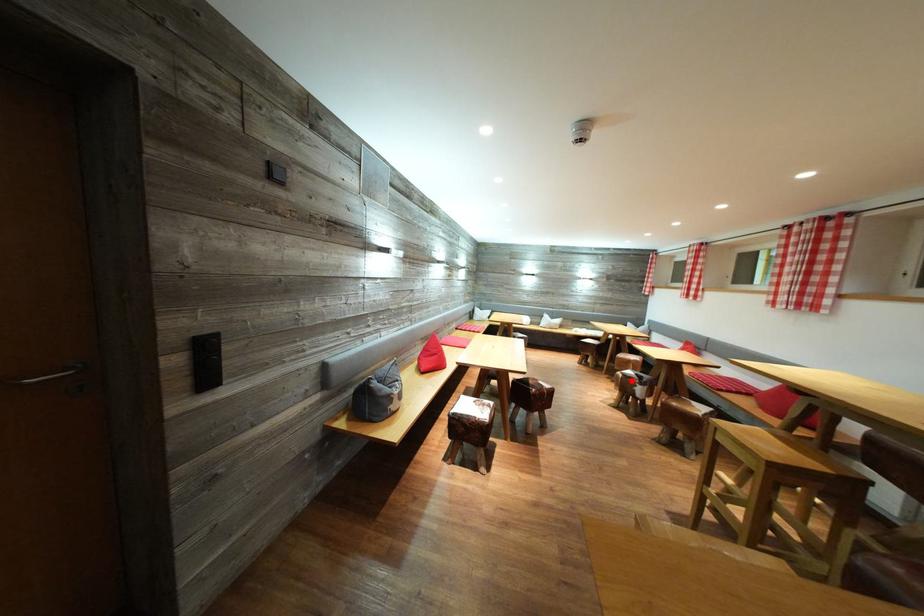
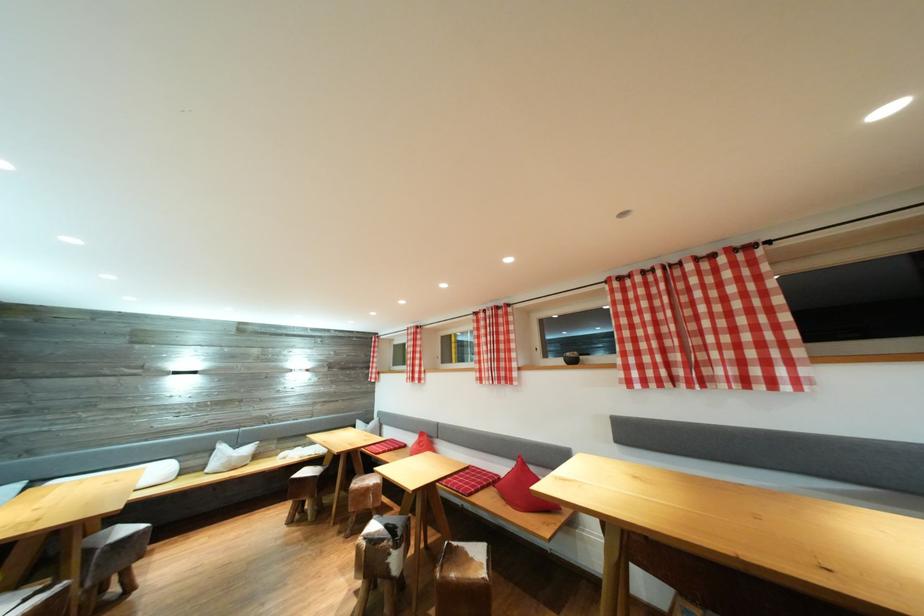
Question: A red point is marked in image1. In image2, is the corresponding 3D point closer to the camera or farther? Reply with the corresponding letter.

Choices:
 (A) The corresponding 3D point is closer.
 (B) The corresponding 3D point is farther.

Answer: (B)